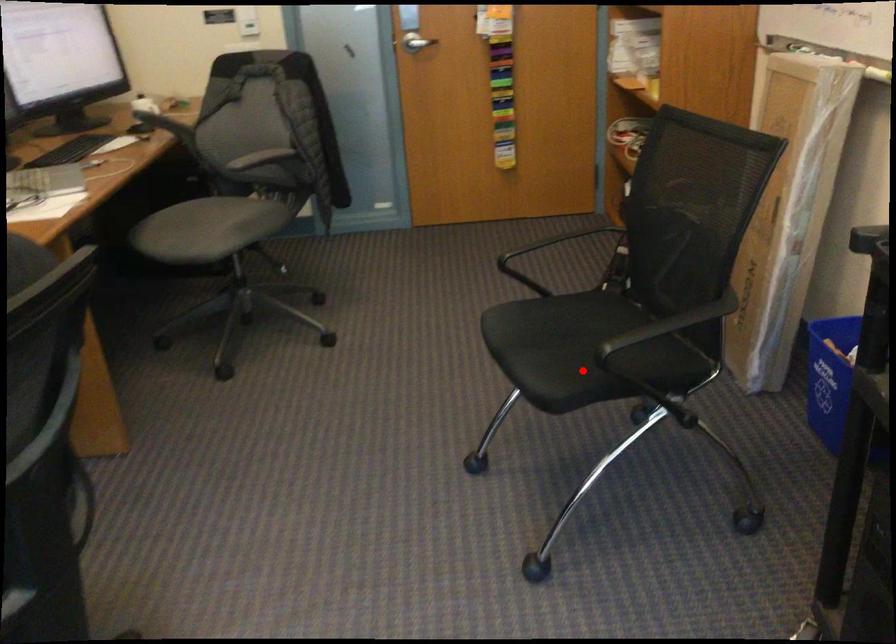
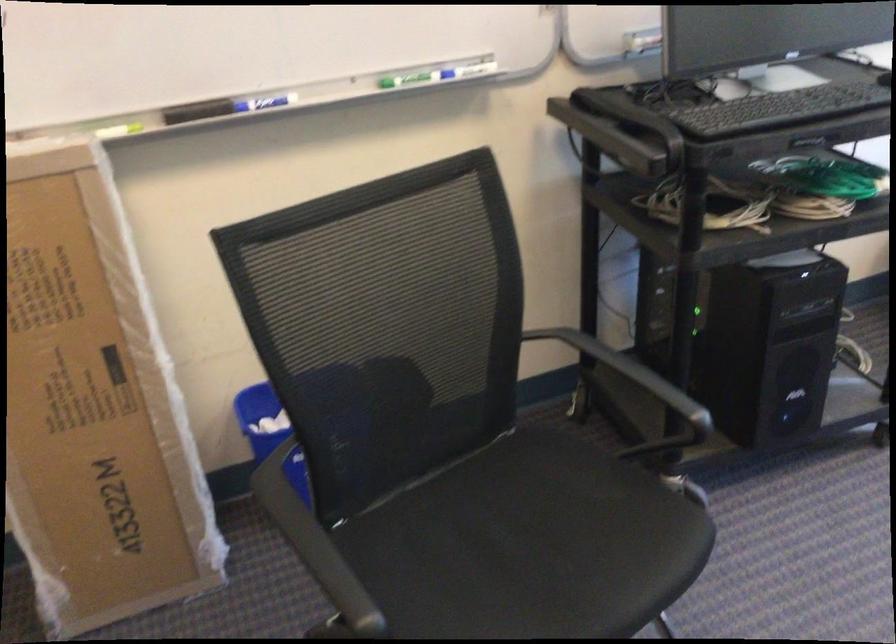
Question: I am providing you with two images of the same scene from different viewpoints. A red point is shown in image1. For the corresponding object point in image2, is it positioned nearer or farther from the camera?

Choices:
 (A) Nearer
 (B) Farther

Answer: (A)